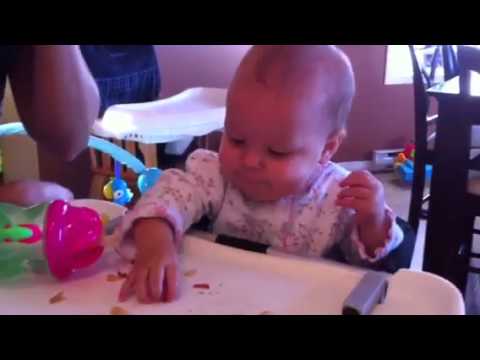
This screenshot has width=480, height=360. I want to click on sipee cup, so click(x=34, y=224).